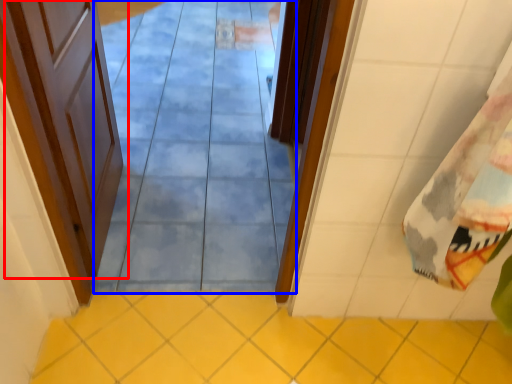
Question: Which point is closer to the camera, door (highlighted by a red box) or path (highlighted by a blue box)?

Choices:
 (A) door
 (B) path

Answer: (B)